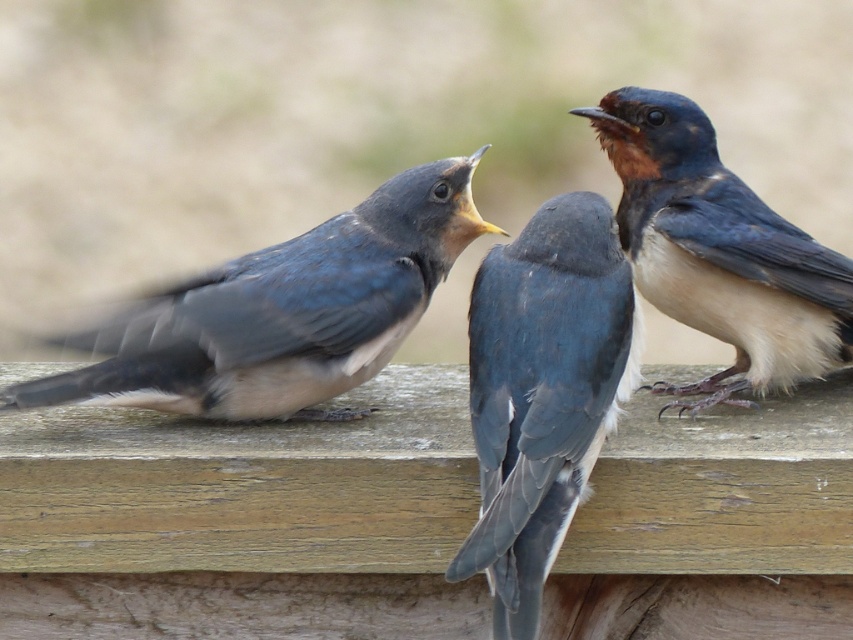
Is the position of blue-gray feathers at left less distant than that of satin blue feathers at center?

No.

Who is shorter, blue-gray feathers at left or satin blue feathers at center?

Standing shorter between the two is blue-gray feathers at left.

Find the location of a particular element. blue-gray feathers at left is located at coordinates (281, 312).

Between blue-gray feathers at left and blue-gray feathers at center, which one appears on the right side from the viewer's perspective?

blue-gray feathers at center

Does blue-gray feathers at left appear on the right side of blue-gray feathers at center?

In fact, blue-gray feathers at left is to the left of blue-gray feathers at center.

Does point (53, 388) lie behind point (785, 333)?

No.

Identify the location of blue-gray feathers at left. The width and height of the screenshot is (853, 640). (281, 312).

Is satin blue feathers at center thinner than blue-gray feathers at center?

Yes, satin blue feathers at center is thinner than blue-gray feathers at center.

Measure the distance between satin blue feathers at center and blue-gray feathers at center.

satin blue feathers at center and blue-gray feathers at center are 27.55 centimeters apart.

Does point (532, 321) lie in front of point (682, 122)?

Yes, it is in front of point (682, 122).

The image size is (853, 640). In order to click on satin blue feathers at center in this screenshot , I will do click(x=543, y=392).